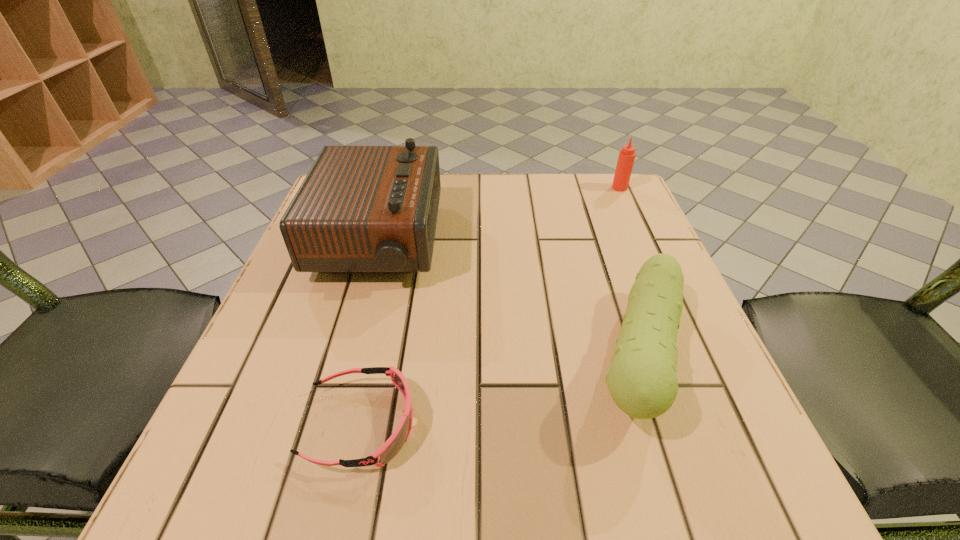
Locate an element on the screen. The width and height of the screenshot is (960, 540). vacant region at the far edge is located at coordinates [x=474, y=222].

Where is `free region at the near edge`? free region at the near edge is located at coordinates (360, 481).

Where is `vacant space at the left edge`? The width and height of the screenshot is (960, 540). vacant space at the left edge is located at coordinates pyautogui.click(x=321, y=301).

What are the coordinates of `vacant space at the right edge of the desktop` in the screenshot? It's located at (593, 244).

Image resolution: width=960 pixels, height=540 pixels. In order to click on vacant area between the goggles and the cucumber in this screenshot , I will do click(500, 390).

Identify the location of vacant area that lies between the cucumber and the Tabasco sauce. (630, 272).

Where is `vacant space that's between the radio receiver and the cucumber`? Image resolution: width=960 pixels, height=540 pixels. vacant space that's between the radio receiver and the cucumber is located at coordinates (509, 299).

At what (x,y) coordinates should I click in order to perform the action: click on vacant point located between the goggles and the cucumber. Please return your answer as a coordinate pair (x, y). This screenshot has height=540, width=960. Looking at the image, I should click on (500, 390).

Locate an element on the screen. free space between the radio receiver and the shortest object is located at coordinates (370, 333).

Where is `vacant point located between the tallest object and the cucumber`? This screenshot has height=540, width=960. vacant point located between the tallest object and the cucumber is located at coordinates (509, 299).